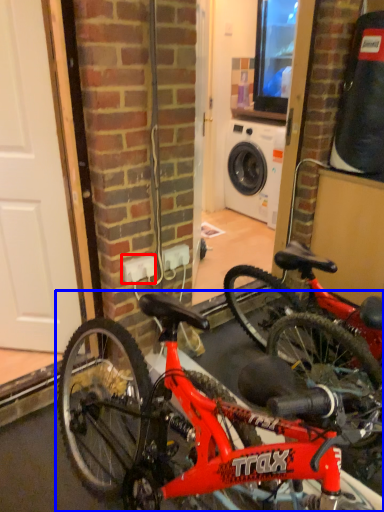
Question: Among these objects, which one is farthest to the camera, electric outlet (highlighted by a red box) or bicycle (highlighted by a blue box)?

Choices:
 (A) electric outlet
 (B) bicycle

Answer: (A)